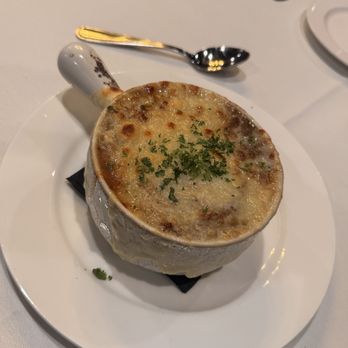
The width and height of the screenshot is (348, 348). Find the location of `black napkin`. black napkin is located at coordinates (78, 183), (185, 288).